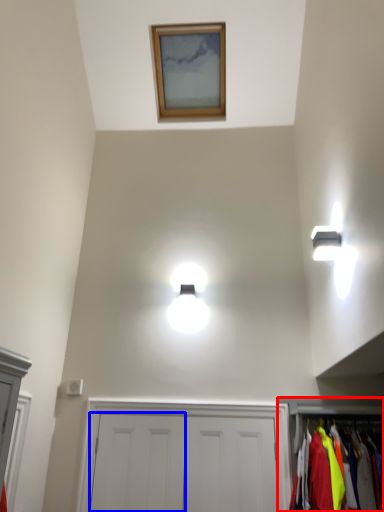
Question: Which point is closer to the camera, dresser (highlighted by a red box) or door (highlighted by a blue box)?

Choices:
 (A) dresser
 (B) door

Answer: (A)